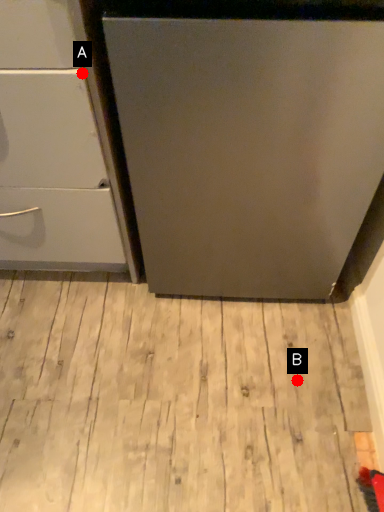
Question: Two points are circled on the image, labeled by A and B beside each circle. Which point is farther from the camera taking this photo?

Choices:
 (A) A is further
 (B) B is further

Answer: (B)